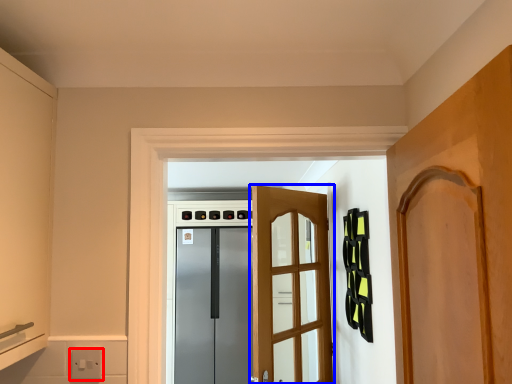
Question: Among these objects, which one is farthest to the camera, electric outlet (highlighted by a red box) or door (highlighted by a blue box)?

Choices:
 (A) electric outlet
 (B) door

Answer: (B)